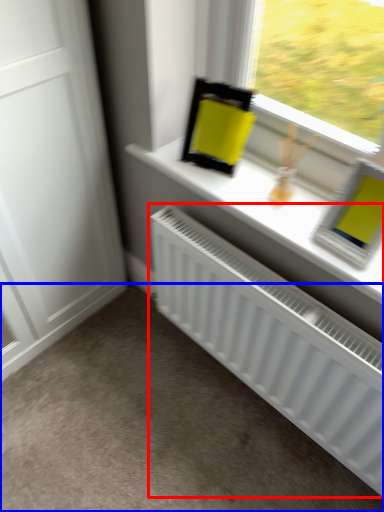
Question: Which object is further to the camera taking this photo, radiator (highlighted by a red box) or plain (highlighted by a blue box)?

Choices:
 (A) radiator
 (B) plain

Answer: (B)